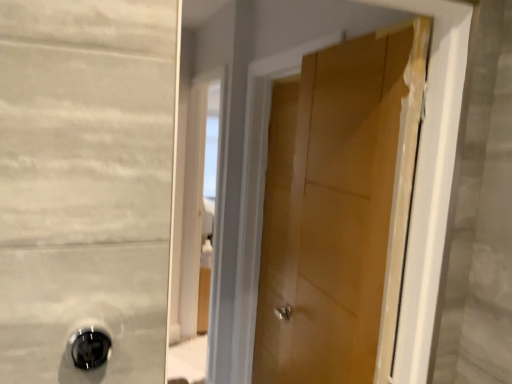
You are a GUI agent. You are given a task and a screenshot of the screen. Output one action in this format:
    pyautogui.click(x=<x>, y=<y>)
    Task: Click on the wooden door at center
    This screenshot has width=512, height=384.
    Given the screenshot: What is the action you would take?
    coord(338,210)

The height and width of the screenshot is (384, 512). What do you see at coordinates (338, 210) in the screenshot?
I see `wooden door at center` at bounding box center [338, 210].

The height and width of the screenshot is (384, 512). Describe the element at coordinates (90, 348) in the screenshot. I see `black glossy door handle at lower left` at that location.

Locate an element on the screen. black glossy door handle at lower left is located at coordinates (90, 348).

What is the approximate width of black glossy door handle at lower left?

It is 1.87 inches.

Where is `wooden door at center`? wooden door at center is located at coordinates tap(338, 210).

Can you confirm if wooden door at center is positioned to the left of black glossy door handle at lower left?

No.

Does wooden door at center lie behind black glossy door handle at lower left?

Yes.

Does point (325, 173) come closer to viewer compared to point (73, 335)?

No.

From the image's perspective, does wooden door at center appear higher than black glossy door handle at lower left?

Yes.

Consider the image. From a real-world perspective, is wooden door at center positioned under black glossy door handle at lower left based on gravity?

Yes, from a real-world perspective, wooden door at center is below black glossy door handle at lower left.

Which of these two, wooden door at center or black glossy door handle at lower left, is wider?

With larger width is wooden door at center.

Considering the sizes of wooden door at center and black glossy door handle at lower left in the image, is wooden door at center taller or shorter than black glossy door handle at lower left?

wooden door at center is taller than black glossy door handle at lower left.

In terms of size, does wooden door at center appear bigger or smaller than black glossy door handle at lower left?

Considering their sizes, wooden door at center takes up more space than black glossy door handle at lower left.

Is wooden door at center outside of black glossy door handle at lower left?

That's correct, wooden door at center is outside of black glossy door handle at lower left.

Are wooden door at center and black glossy door handle at lower left beside each other?

There is a gap between wooden door at center and black glossy door handle at lower left.

In the scene shown: Is wooden door at center oriented towards black glossy door handle at lower left?

Yes, wooden door at center faces towards black glossy door handle at lower left.

Image resolution: width=512 pixels, height=384 pixels. Find the location of `door on the right of black glossy door handle at lower left`. door on the right of black glossy door handle at lower left is located at coordinates (338, 210).

Between black glossy door handle at lower left and wooden door at center, which one appears on the left side from the viewer's perspective?

black glossy door handle at lower left.

Considering the positions of objects black glossy door handle at lower left and wooden door at center in the image provided, who is in front, black glossy door handle at lower left or wooden door at center?

black glossy door handle at lower left is more forward.

Is point (104, 343) positioned after point (368, 75)?

No, (104, 343) is closer to viewer.

Consider the image. From the image's perspective, who appears lower, black glossy door handle at lower left or wooden door at center?

black glossy door handle at lower left.

From the picture: From a real-world perspective, which is physically above, black glossy door handle at lower left or wooden door at center?

black glossy door handle at lower left is physically above.

Which of these two, black glossy door handle at lower left or wooden door at center, is thinner?

black glossy door handle at lower left is thinner.

Considering the sizes of objects black glossy door handle at lower left and wooden door at center in the image provided, who is taller, black glossy door handle at lower left or wooden door at center?

wooden door at center.

Can you confirm if black glossy door handle at lower left is bigger than wooden door at center?

Incorrect, black glossy door handle at lower left is not larger than wooden door at center.

Does black glossy door handle at lower left contain wooden door at center?

Actually, wooden door at center is outside black glossy door handle at lower left.

Are black glossy door handle at lower left and wooden door at center making contact?

black glossy door handle at lower left and wooden door at center are not in contact.

From the picture: Is wooden door at center at the back of black glossy door handle at lower left?

black glossy door handle at lower left does not have its back to wooden door at center.

How many degrees apart are the facing directions of black glossy door handle at lower left and wooden door at center?

black glossy door handle at lower left and wooden door at center are facing 91.7 degrees away from each other.

Identify the location of door handle that appears above the wooden door at center (from a real-world perspective). (90, 348).

The width and height of the screenshot is (512, 384). I want to click on door handle below the wooden door at center (from the image's perspective), so click(90, 348).

Locate an element on the screen. The height and width of the screenshot is (384, 512). door on the right side of black glossy door handle at lower left is located at coordinates (338, 210).